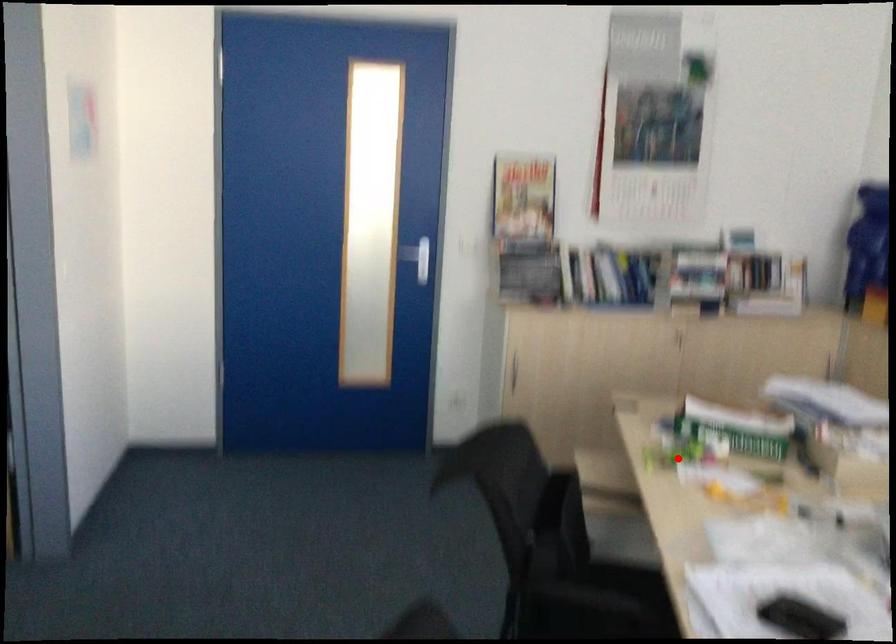
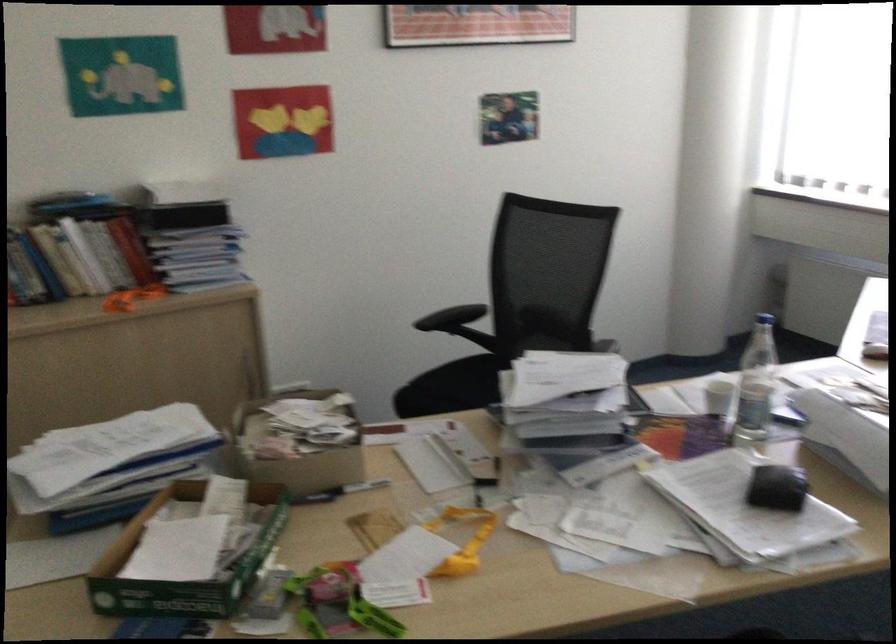
In the second image, find the point that corresponds to the highlighted location in the first image.

(345, 603)